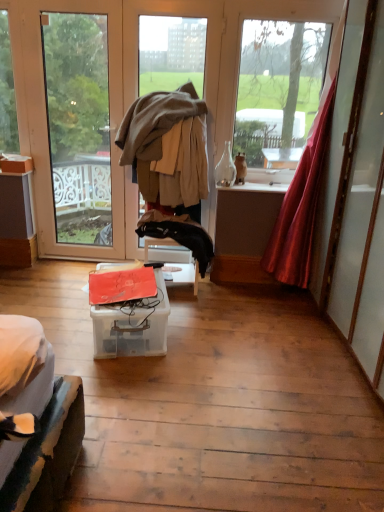
Find the location of a particular element. The image size is (384, 512). vacant area on top of matte cardboard box at left, the second box when ordered from right to left (from a real-world perspective) is located at coordinates (26, 155).